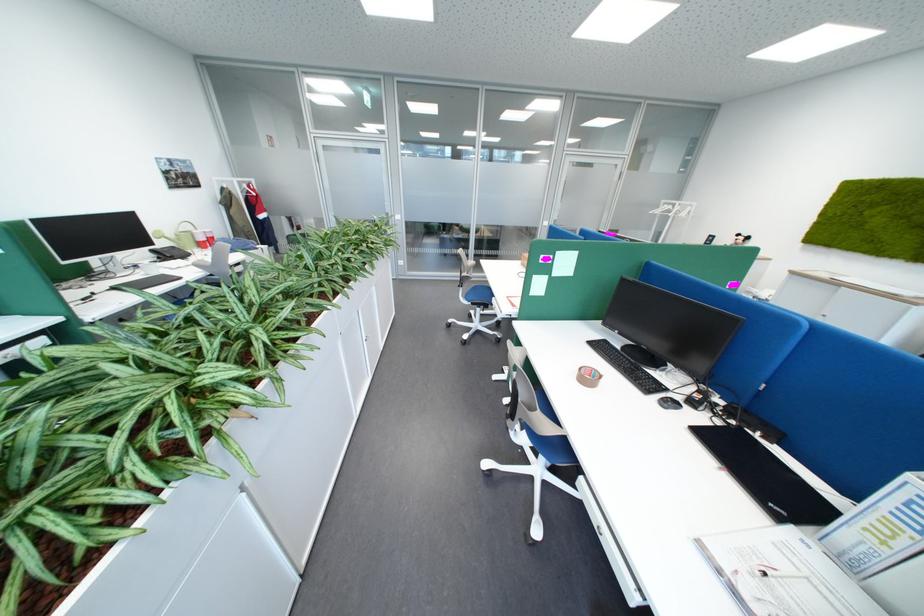
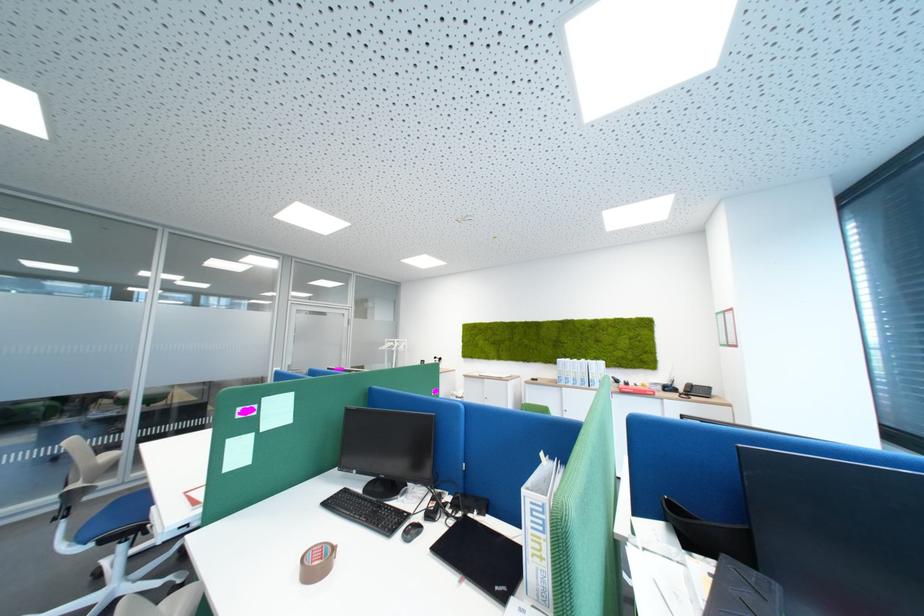
Find the pixel in the second image that matches [484,313] in the first image.

(118, 562)